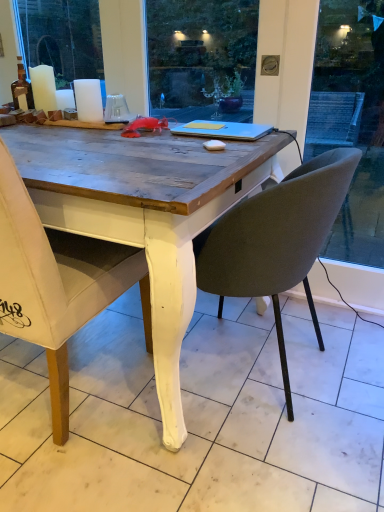
The width and height of the screenshot is (384, 512). Find the location of `free region under white fabric chair at left, which is the second chair from right to left (from a real-world perspective)`. free region under white fabric chair at left, which is the second chair from right to left (from a real-world perspective) is located at coordinates (71, 386).